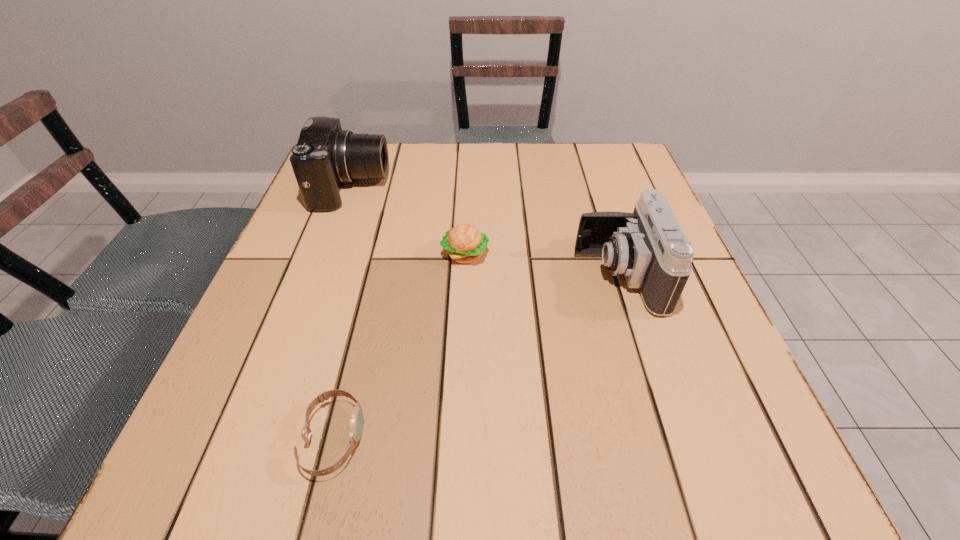
I want to click on blank region between the nearest object and the hamburger, so click(x=399, y=346).

Where is `free space between the shortest object and the rightmost object`? This screenshot has width=960, height=540. free space between the shortest object and the rightmost object is located at coordinates (476, 357).

Locate an element on the screen. The width and height of the screenshot is (960, 540). empty location between the third tallest object and the nearer camera is located at coordinates (542, 265).

This screenshot has width=960, height=540. What are the coordinates of `free space between the second object from right to left and the farthest object` in the screenshot? It's located at (408, 221).

Image resolution: width=960 pixels, height=540 pixels. I want to click on free space between the second shortest object and the left camera, so click(408, 221).

Identify the location of free point between the third object from left to right and the nearer camera. (542, 265).

You are a GUI agent. You are given a task and a screenshot of the screen. Output one action in this format:
    pyautogui.click(x=<x>, y=<y>)
    Task: Click on the blank region between the right camera and the farther camera
    This screenshot has height=540, width=960.
    Given the screenshot: What is the action you would take?
    tap(485, 232)

Where is `object that stands as the second closest to the watch`? Image resolution: width=960 pixels, height=540 pixels. object that stands as the second closest to the watch is located at coordinates (648, 246).

This screenshot has width=960, height=540. Identify the location of object that is the third nearest to the hamburger. (356, 418).

Locate an element on the screen. vacant position in the image that satisfies the following two spatial constraints: 1. on the lens of the farther camera; 2. on the left side of the hamburger is located at coordinates (326, 254).